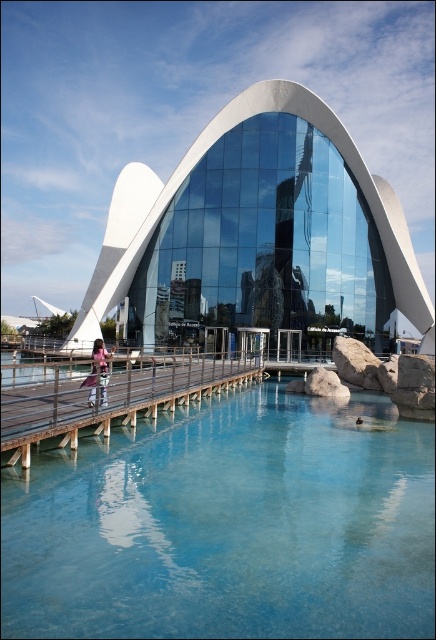
You are standing at point (91, 387) and want to walk to the entrance of the building. The walkway is 10 meters wide. Can you safely walk across it without getting wet?

The distance between you and the entrance is 15.40 meters, which is longer than the walkway width of 10 meters. Therefore, you cannot safely walk across without getting wet.

You are standing on the walkway in front of the futuristic building and notice two points marked on the structure. The first point is at coordinates point (x=204, y=545) and the second is at point (x=343, y=131). Which of these two points is nearer to your current position?

Point (x=204, y=545) is closer to the viewer than point (x=343, y=131), so the first point is nearer to your current position.